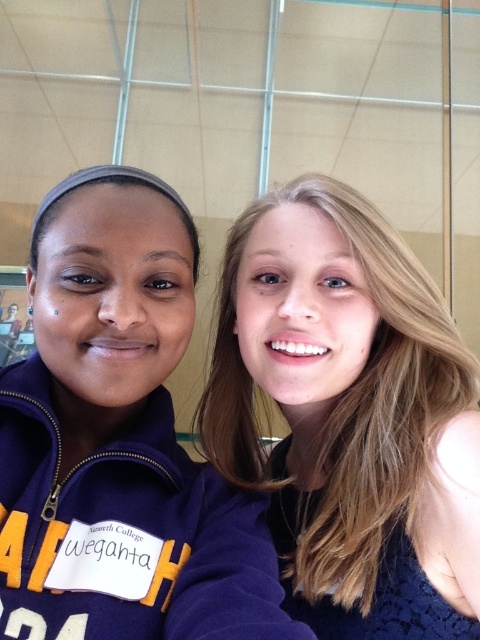
Does point (205, 428) come behind point (48, 541)?

Yes, it is.

Who is higher up, blonde hair at upper right or matte purple sweatshirt at center?

Positioned higher is blonde hair at upper right.

Which is in front, point (408, 333) or point (264, 524)?

Positioned in front is point (264, 524).

Locate an element on the screen. The image size is (480, 640). blonde hair at upper right is located at coordinates 349,417.